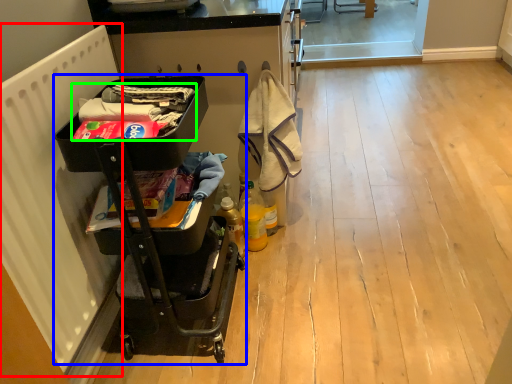
Question: Based on their relative distances, which object is nearer to radiator (highlighted by a red box)? Choose from baby carriage (highlighted by a blue box) and laundry (highlighted by a green box).

Choices:
 (A) baby carriage
 (B) laundry

Answer: (A)